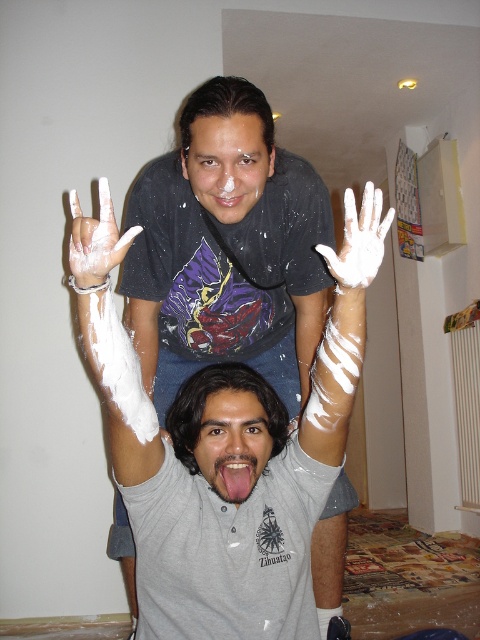
Question: Considering the relative positions of white matte face at center and smooth skin face at center in the image provided, where is white matte face at center located with respect to smooth skin face at center?

Choices:
 (A) left
 (B) right

Answer: (A)

Question: Considering the real-world distances, which object is farthest from the white matte hand at upper center?

Choices:
 (A) white matte face at center
 (B) white matte shirt at center

Answer: (B)

Question: Estimate the real-world distances between objects in this image. Which object is farther from the white matte hand at center?

Choices:
 (A) white matte shirt at center
 (B) smooth skin face at center
 (C) white matte hand at upper center
 (D) white matte face at center

Answer: (A)

Question: Can you confirm if smooth skin face at center is positioned below white matte hand at center?

Choices:
 (A) yes
 (B) no

Answer: (A)

Question: Which point is farther to the camera?

Choices:
 (A) white matte face at center
 (B) smooth skin face at center
 (C) white matte hand at center

Answer: (A)

Question: Is smooth skin face at center closer to camera compared to white matte hand at center?

Choices:
 (A) yes
 (B) no

Answer: (B)